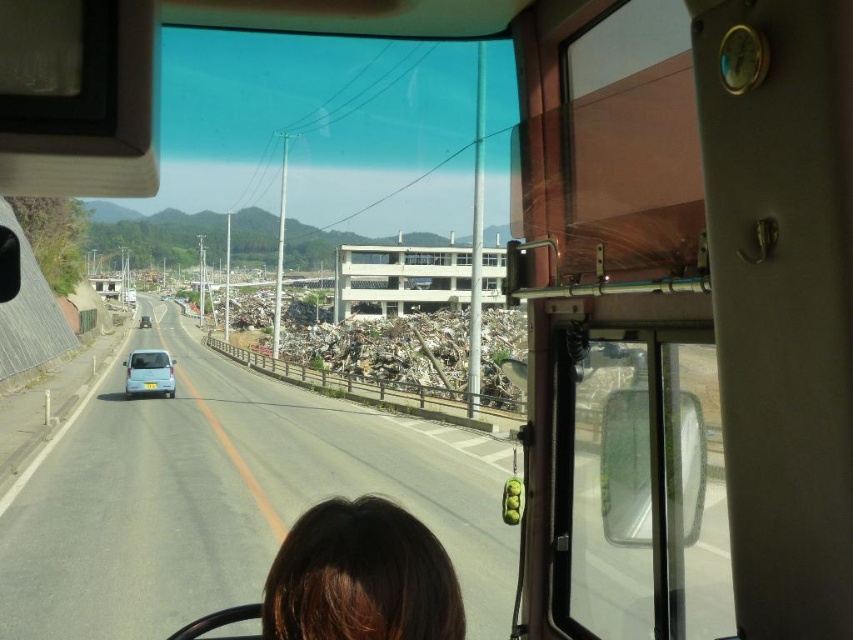
Question: Can you confirm if brown hair at lower center is positioned above light blue matte car at center?

Choices:
 (A) yes
 (B) no

Answer: (A)

Question: Does brown hair at lower center appear on the right side of light blue matte car at center?

Choices:
 (A) yes
 (B) no

Answer: (A)

Question: Which object is farther from the camera taking this photo?

Choices:
 (A) transparent plastic windshield at center
 (B) light blue matte car at center
 (C) brown hair at lower center
 (D) blue matte car at center

Answer: (D)

Question: Which point is closer to the camera?

Choices:
 (A) (142, 317)
 (B) (296, 545)
 (C) (389, 476)

Answer: (B)

Question: Can you confirm if transparent plastic windshield at center is positioned to the left of light blue matte car at center?

Choices:
 (A) no
 (B) yes

Answer: (A)

Question: Which point is closer to the camera taking this photo?

Choices:
 (A) (432, 570)
 (B) (167, 356)

Answer: (A)